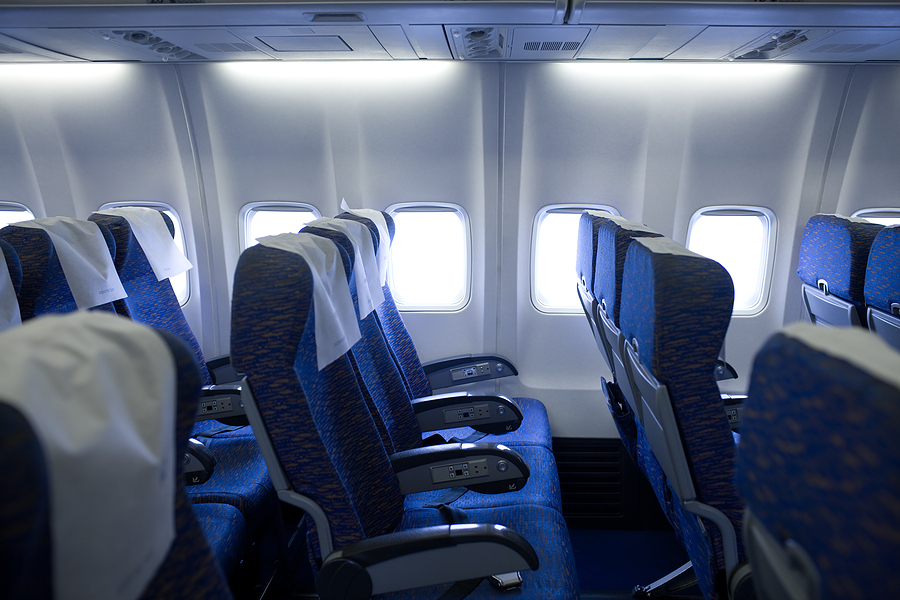
Locate an element on the screen. The height and width of the screenshot is (600, 900). chair handles on the left is located at coordinates (435, 542), (448, 467), (460, 400), (460, 368), (187, 459), (216, 402), (222, 370).